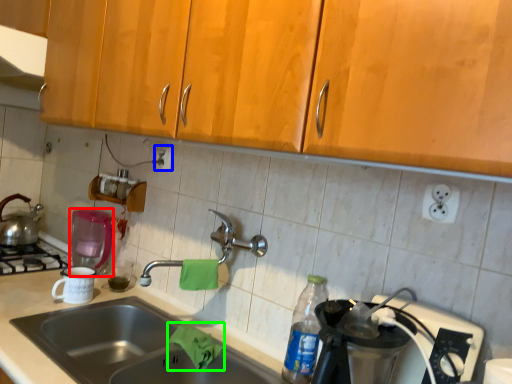
Question: Which object is positioned closest to coffee machine (highlighted by a red box)? Select from electric outlet (highlighted by a blue box) and material (highlighted by a green box).

Choices:
 (A) electric outlet
 (B) material

Answer: (A)